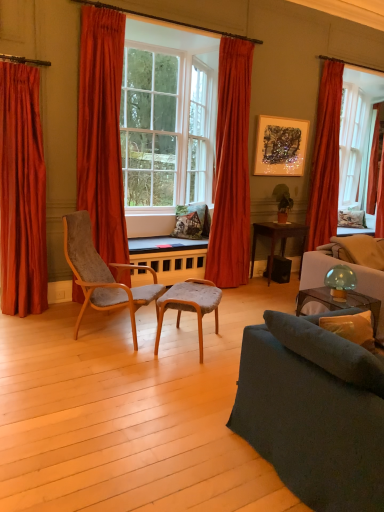
Question: Relative to white fabric pillow at upper right, which appears as the second pillow when viewed from the left, is wooden table at center, positioned as the first table in left-to-right order, in front or behind?

Choices:
 (A) front
 (B) behind

Answer: (A)

Question: Is point (188, 242) closer or farther from the camera than point (357, 212)?

Choices:
 (A) farther
 (B) closer

Answer: (B)

Question: Estimate the real-world distances between objects in this image. Which object is farther from the velvet orange curtain at center, which ranks as the 3th curtain in right-to-left order?

Choices:
 (A) dark gray fabric couch at lower right
 (B) white fabric pillow at upper right, which is counted as the 2th pillow, starting from the bottom
 (C) velvet blue couch at right
 (D) velvet grey chair at center, marked as the 1th chair in a right-to-left arrangement
 (E) yellow fabric pillow at lower right, the 1th pillow viewed from the left

Answer: (A)

Question: Which of these objects is positioned farthest from the satin red curtain at left, which is counted as the 5th curtain, starting from the right?

Choices:
 (A) green matte plant at center
 (B) translucent glass mushroom at upper right
 (C) dark brown wooden table at center, the 2th table positioned from the left
 (D) metallic textured artwork at upper center
 (E) velvet grey chair at left, the first chair viewed from the left

Answer: (A)